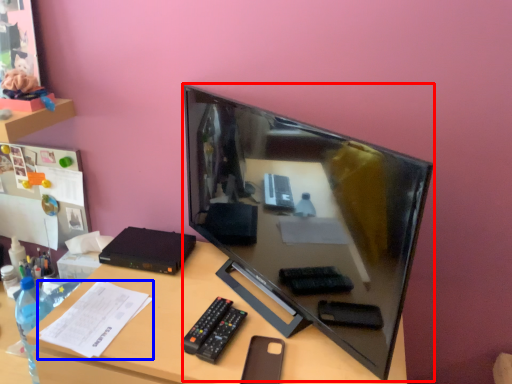
Question: Which object appears closest to the camera in this image, television (highlighted by a red box) or paper (highlighted by a blue box)?

Choices:
 (A) television
 (B) paper

Answer: (A)